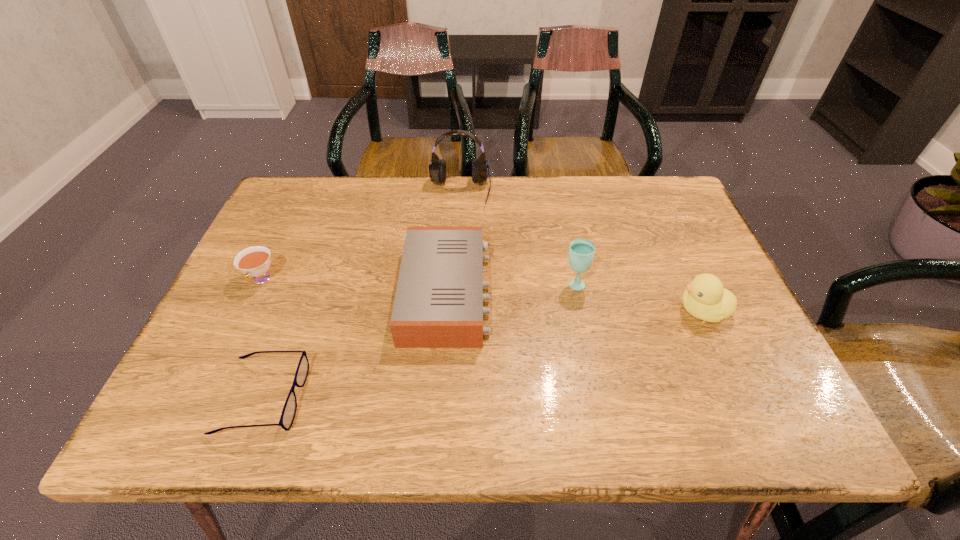
Where is `spectacles situated at the left edge`? spectacles situated at the left edge is located at coordinates (288, 414).

The height and width of the screenshot is (540, 960). I want to click on object that is at the right edge, so click(x=705, y=298).

Where is `object present at the near left corner`? The height and width of the screenshot is (540, 960). object present at the near left corner is located at coordinates (288, 414).

In the image, there is a desktop. Find the location of `vacant space at the far edge`. vacant space at the far edge is located at coordinates (595, 213).

Find the location of a particular element. vacant area at the near edge is located at coordinates (514, 406).

Locate an element on the screen. The image size is (960, 540). free space at the left edge is located at coordinates (252, 296).

In order to click on vacant space at the right edge of the desktop in this screenshot , I will do `click(687, 228)`.

Image resolution: width=960 pixels, height=540 pixels. In the image, there is a desktop. What are the coordinates of `vacant space at the near left corner` in the screenshot? It's located at (214, 437).

Find the location of a particular element. The height and width of the screenshot is (540, 960). vacant space that is in between the teacup and the spectacles is located at coordinates (262, 338).

This screenshot has height=540, width=960. Find the location of `vacant space in between the glass and the rightmost object`. vacant space in between the glass and the rightmost object is located at coordinates (638, 297).